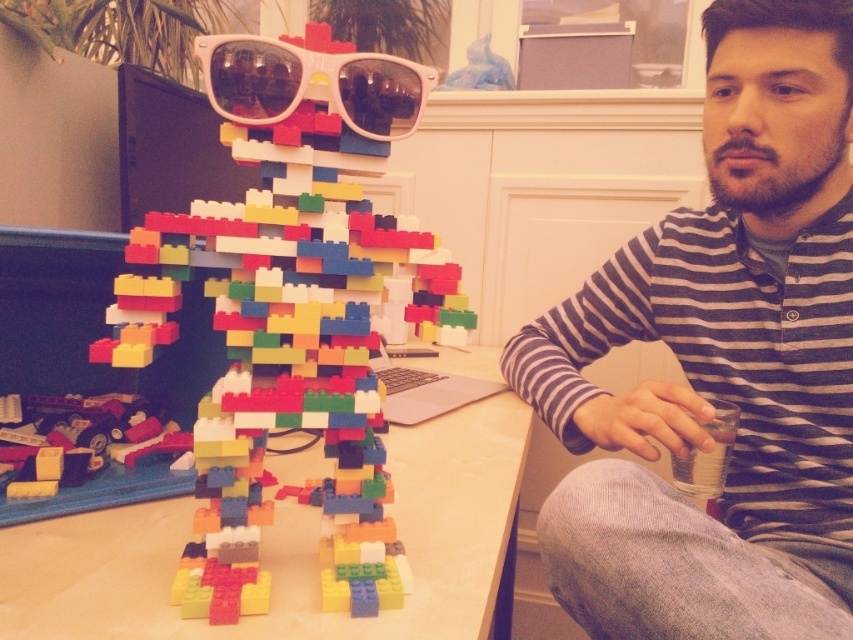
Question: Is striped cotton shirt at upper right further to the viewer compared to wooden table at center?

Choices:
 (A) no
 (B) yes

Answer: (B)

Question: Which point is closer to the camera taking this photo?

Choices:
 (A) (367, 484)
 (B) (363, 627)

Answer: (B)

Question: Which of the following is the farthest from the observer?

Choices:
 (A) (428, 68)
 (B) (287, 300)
 (C) (524, 422)

Answer: (C)

Question: Is striped cotton shirt at upper right above wooden table at center?

Choices:
 (A) no
 (B) yes

Answer: (B)

Question: Is striped cotton shirt at upper right thinner than multicolored plastic blocks at center?

Choices:
 (A) yes
 (B) no

Answer: (B)

Question: Which is nearer to the multicolored plastic blocks at center?

Choices:
 (A) wooden table at center
 (B) white plastic sunglasses at upper center
 (C) striped cotton shirt at upper right

Answer: (B)